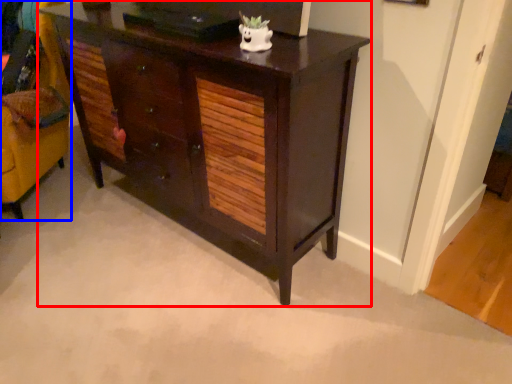
Question: Which point is closer to the camera, chest of drawers (highlighted by a red box) or swivel chair (highlighted by a blue box)?

Choices:
 (A) chest of drawers
 (B) swivel chair

Answer: (A)